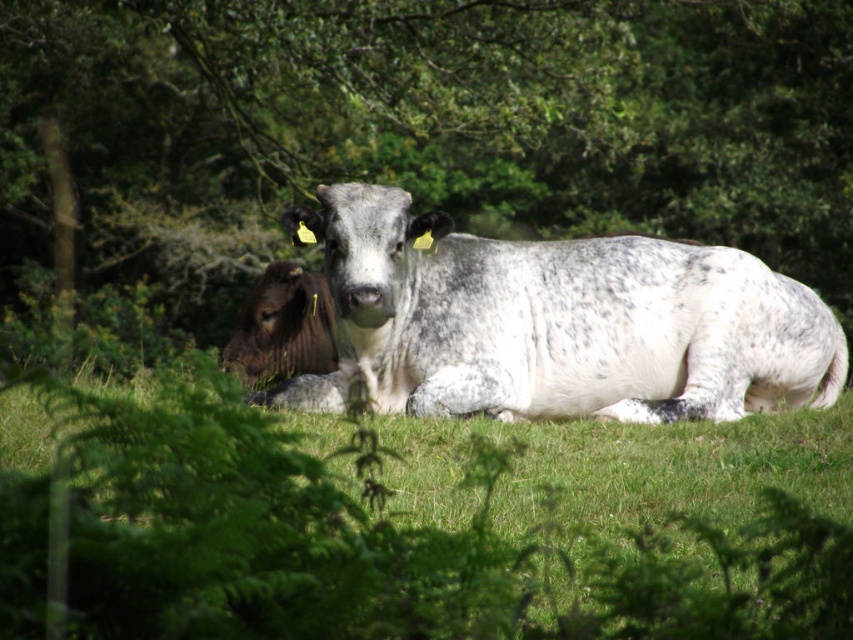
Does point (775, 612) come farther from viewer compared to point (293, 266)?

That is False.

Does point (691, 600) come in front of point (289, 268)?

Yes, point (691, 600) is closer to viewer.

This screenshot has height=640, width=853. I want to click on green grassy at center, so click(x=360, y=541).

Find the location of a particular element. green grassy at center is located at coordinates (360, 541).

Does point (199, 426) come farther from viewer compared to point (612, 307)?

That is False.

Identify the location of green grassy at center. (360, 541).

The image size is (853, 640). I want to click on green grassy at center, so click(x=360, y=541).

The width and height of the screenshot is (853, 640). I want to click on green leafy tree at center, so [425, 125].

Between green leafy tree at center and dark brown fur at left, which one appears on the right side from the viewer's perspective?

Positioned to the right is green leafy tree at center.

Identify the location of green leafy tree at center. The width and height of the screenshot is (853, 640). (425, 125).

This screenshot has height=640, width=853. What are the coordinates of `green leafy tree at center` in the screenshot? It's located at (425, 125).